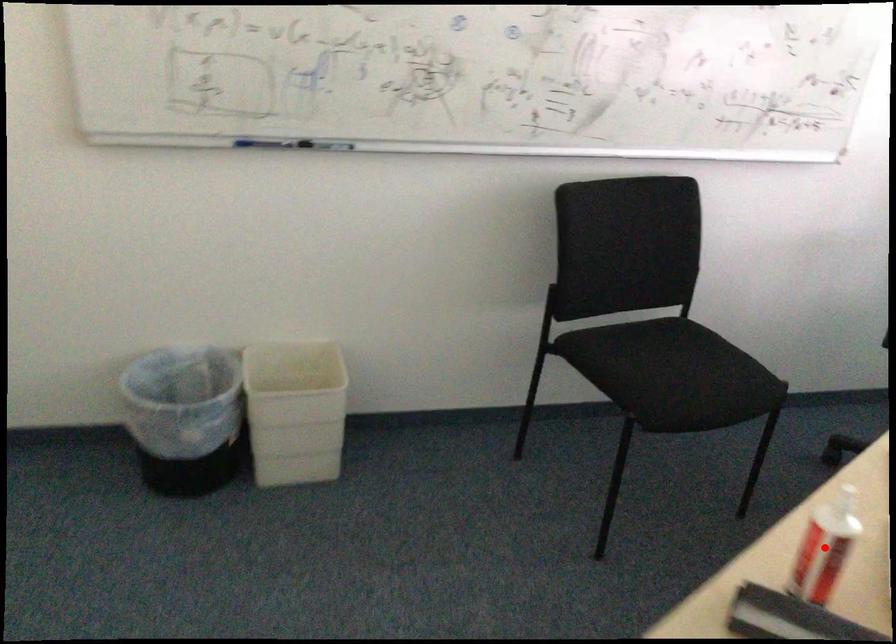
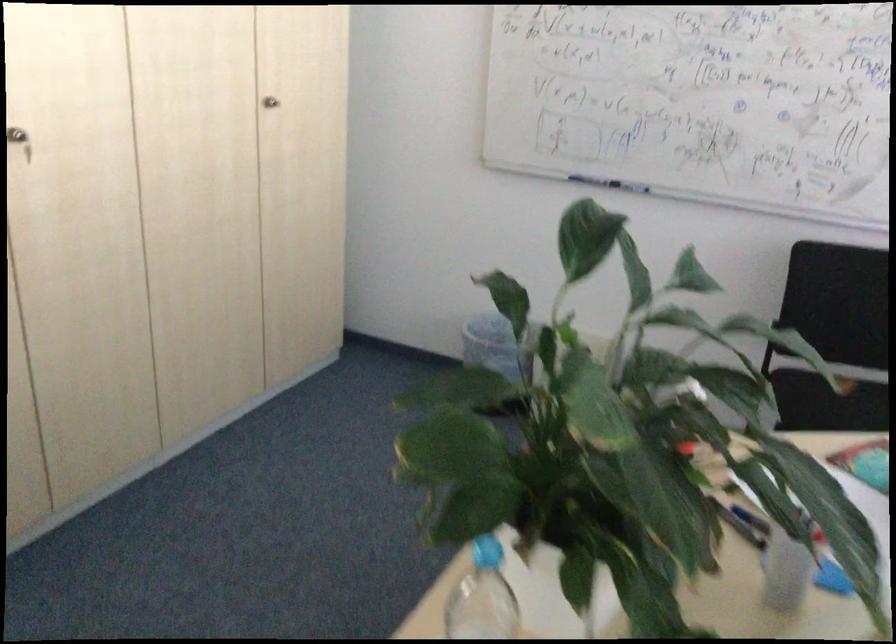
Question: I am providing you with two images of the same scene from different viewpoints. A red point is marked on the first image. Is the red point's position out of view in image 2?

Choices:
 (A) Yes
 (B) No

Answer: (A)